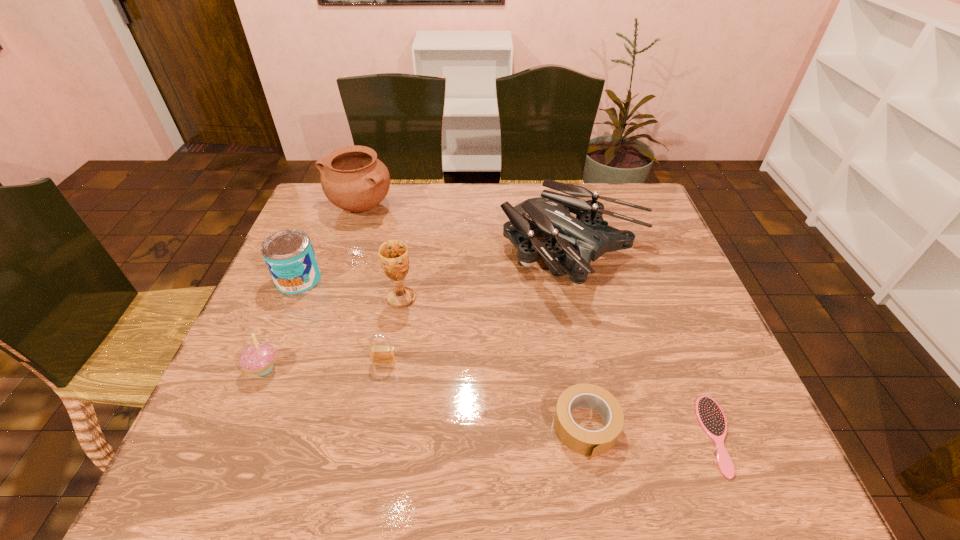
This screenshot has width=960, height=540. I want to click on vacant space located 0.100m on the back of the drone, so click(x=560, y=195).

You are a GUI agent. You are given a task and a screenshot of the screen. Output one action in this format:
    pyautogui.click(x=<x>, y=<y>)
    Task: Click on the vacant area situated 0.230m on the back of the can
    This screenshot has width=960, height=540.
    Given the screenshot: What is the action you would take?
    pyautogui.click(x=325, y=216)

Find the location of `vacant space located on the back of the cupcake`. vacant space located on the back of the cupcake is located at coordinates [288, 312].

Image resolution: width=960 pixels, height=540 pixels. Identify the location of free space located 0.050m on the front-facing side of the padlock. (380, 383).

Locate an element on the screen. vacant space located 0.170m on the back of the hairbrush is located at coordinates (677, 334).

The height and width of the screenshot is (540, 960). In order to click on pottery that is at the far edge in this screenshot , I will do [x=352, y=178].

Where is `drone at the far edge`? drone at the far edge is located at coordinates (572, 243).

Identify the location of duct tape present at the near edge. The width and height of the screenshot is (960, 540). (591, 443).

Locate an element on the screen. hairbrush that is at the near edge is located at coordinates (711, 418).

Where is `pottery situated at the left edge`? The image size is (960, 540). pottery situated at the left edge is located at coordinates (352, 178).